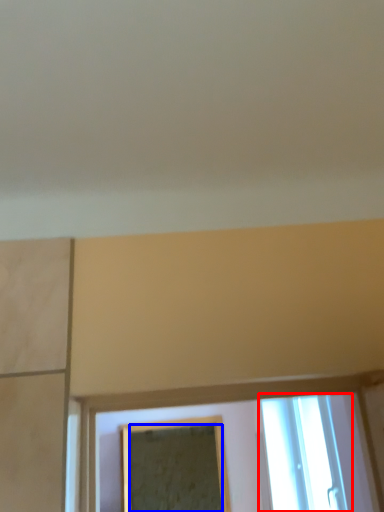
Question: Which object is further to the camera taking this photo, window (highlighted by a red box) or mirror (highlighted by a blue box)?

Choices:
 (A) window
 (B) mirror

Answer: (B)